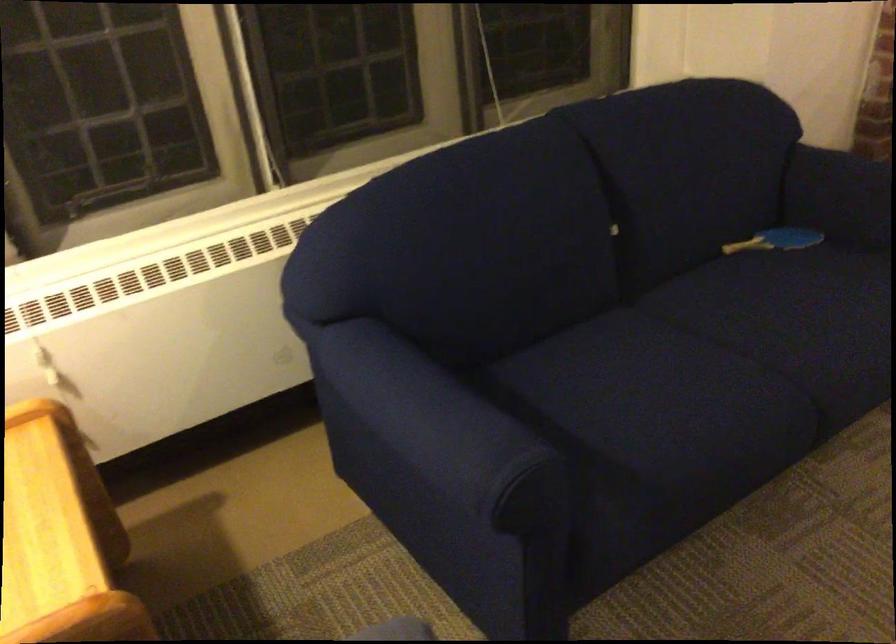
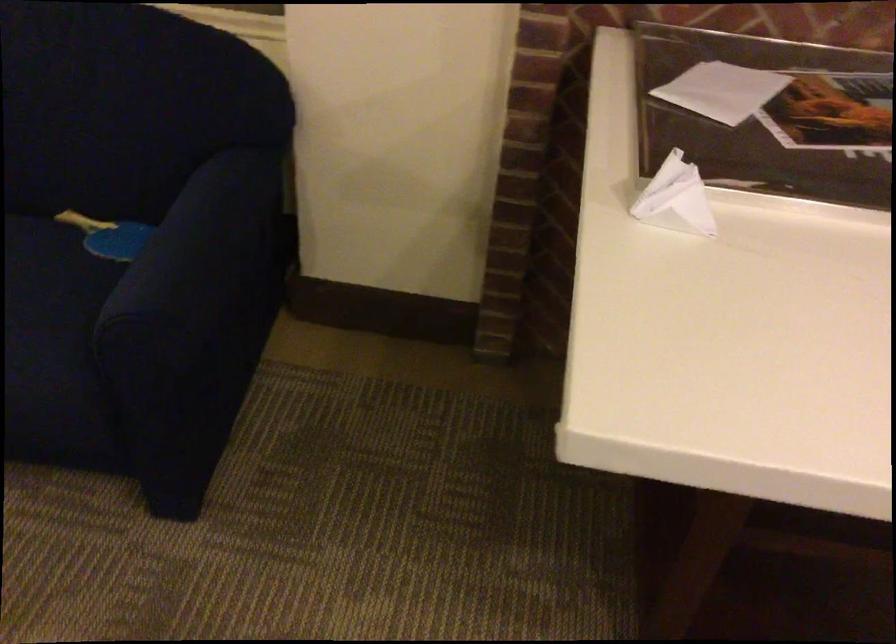
Where in the second image is the point corresponding to (780,234) from the first image?

(108, 236)